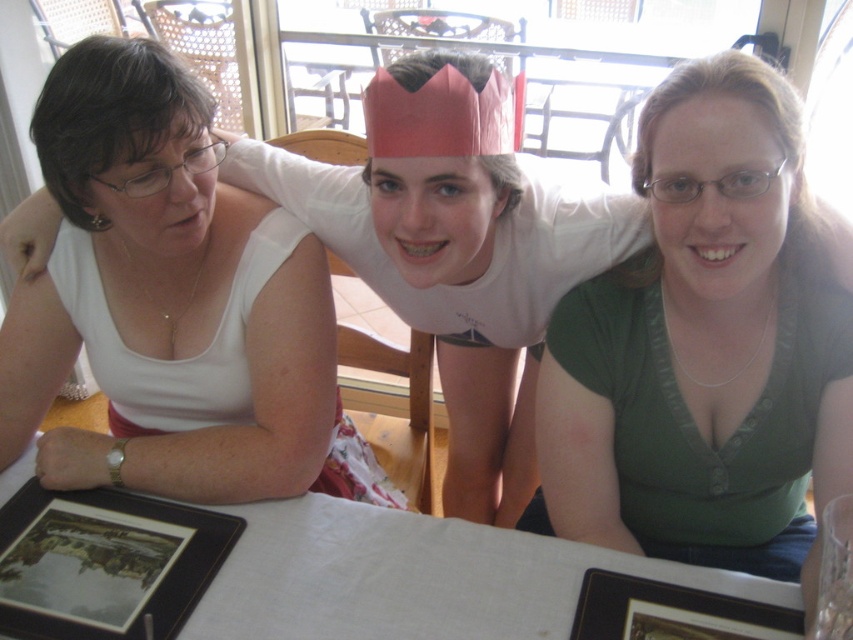
Looking at this image, you are a guest at this table and want to place your phone on the white cloth table at center. However, you notice the black matte picture frame at lower left nearby. Where should you place your phone to ensure it is closer to the edge of the table?

Place your phone on the white cloth table at center near the edge opposite the black matte picture frame at lower left since the table is located below the frame, meaning the frame is above the table. Placing the phone near the edge away from the frame would keep it closer to the table edge.

You are a photographer wanting to capture a closeup of the black matte picture frame at lower left without including the white cloth table at center in the shot. Is it possible to do so from your current position?

The black matte picture frame at lower left is behind the white cloth table at center, so it is obscured by the table. Therefore, you cannot capture a closeup of the black matte picture frame at lower left without the white cloth table at center in the shot from your current position.